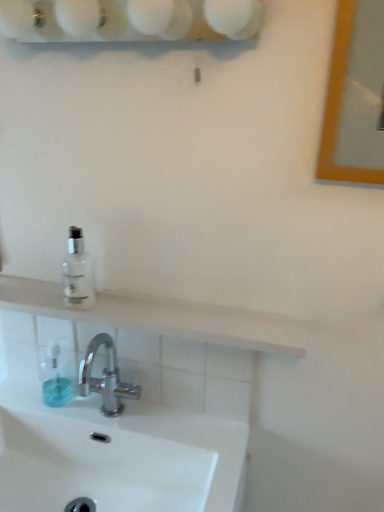
Question: From their relative heights in the image, would you say transparent glass bottle at upper left is taller or shorter than wooden frame mirror at upper right?

Choices:
 (A) tall
 (B) short

Answer: (B)

Question: Considering the positions of transparent glass bottle at upper left and wooden frame mirror at upper right in the image, is transparent glass bottle at upper left wider or thinner than wooden frame mirror at upper right?

Choices:
 (A) thin
 (B) wide

Answer: (B)

Question: Which object is the farthest from the white glossy sink at lower center?

Choices:
 (A) transparent glass bottle at upper left
 (B) white glossy shelf at upper center
 (C) transparent plastic soap dispenser at lower left
 (D) wooden frame mirror at upper right
 (E) white matte shelf at upper center

Answer: (B)

Question: Estimate the real-world distances between objects in this image. Which object is closer to the white glossy sink at lower center?

Choices:
 (A) transparent plastic soap dispenser at lower left
 (B) white matte shelf at upper center
 (C) transparent glass bottle at upper left
 (D) wooden frame mirror at upper right
 (E) white glossy shelf at upper center

Answer: (A)